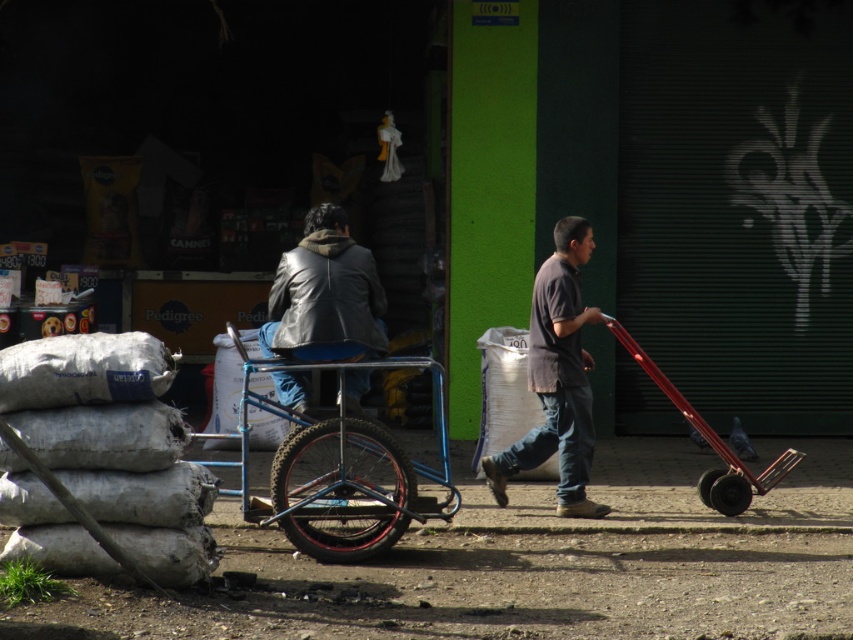
Question: Can you confirm if blue metallic wagon at center is positioned below leather jacket at center?

Choices:
 (A) no
 (B) yes

Answer: (B)

Question: Based on their relative distances, which object is nearer to the leather jacket at center?

Choices:
 (A) dark gray shirt at center
 (B) blue metallic wagon at center

Answer: (B)

Question: Based on their relative distances, which object is nearer to the leather jacket at center?

Choices:
 (A) dark gray shirt at center
 (B) blue metallic wagon at center

Answer: (B)

Question: Can you confirm if blue metallic wagon at center is positioned above dark gray shirt at center?

Choices:
 (A) no
 (B) yes

Answer: (A)

Question: Among these points, which one is farthest from the camera?

Choices:
 (A) (283, 474)
 (B) (363, 348)
 (C) (538, 339)

Answer: (C)

Question: Does dark gray shirt at center have a greater width compared to leather jacket at center?

Choices:
 (A) yes
 (B) no

Answer: (B)